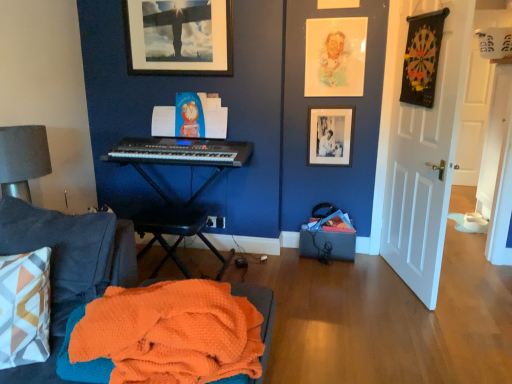
Question: Is black plastic music stool at center taller or shorter than white matte door at right?

Choices:
 (A) tall
 (B) short

Answer: (B)

Question: In terms of size, does black plastic music stool at center appear bigger or smaller than white matte door at right?

Choices:
 (A) big
 (B) small

Answer: (B)

Question: Which object is the closest to the black matte picture frame at upper right, which is the 1th picture frame in right-to-left order?

Choices:
 (A) pastel watercolor portrait at upper center
 (B) matte black picture frame at upper center, which is the first picture frame from left to right
 (C) black fabric box at lower right
 (D) black plastic music stool at center
 (E) black plastic keyboard at center

Answer: (A)

Question: Considering the real-world distances, which object is farthest from the pastel watercolor portrait at upper center?

Choices:
 (A) white matte door at right
 (B) orange waffle knit blanket at lower left
 (C) black matte picture frame at upper right, arranged as the 2th picture frame when viewed from the top
 (D) black plastic keyboard at center
 (E) black plastic music stool at center

Answer: (B)